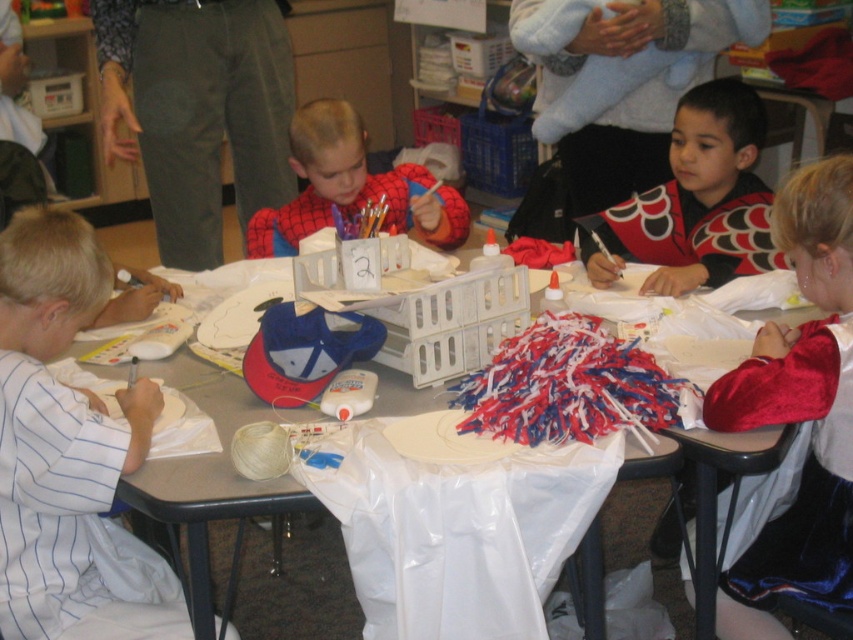
Is point (107, 292) positioned before point (437, 202)?

Yes, it is.

The image size is (853, 640). I want to click on white striped shirt at left, so click(x=68, y=452).

Does white striped shirt at left lie in front of smooth plastic table at center?

No, it is behind smooth plastic table at center.

Consider the image. Between white striped shirt at left and smooth plastic table at center, which one appears on the right side from the viewer's perspective?

From the viewer's perspective, smooth plastic table at center appears more on the right side.

Describe the element at coordinates (68, 452) in the screenshot. I see `white striped shirt at left` at that location.

At what (x,y) coordinates should I click in order to perform the action: click on white striped shirt at left. Please return your answer as a coordinate pair (x, y). Looking at the image, I should click on (68, 452).

Does red and black costume at center have a larger size compared to spiderman costume at center?

No.

Is red and black costume at center above spiderman costume at center?

No, red and black costume at center is not above spiderman costume at center.

Does point (711, 116) come farther from viewer compared to point (316, 179)?

No, (711, 116) is in front of (316, 179).

The width and height of the screenshot is (853, 640). In order to click on red and black costume at center in this screenshot , I will do `click(695, 200)`.